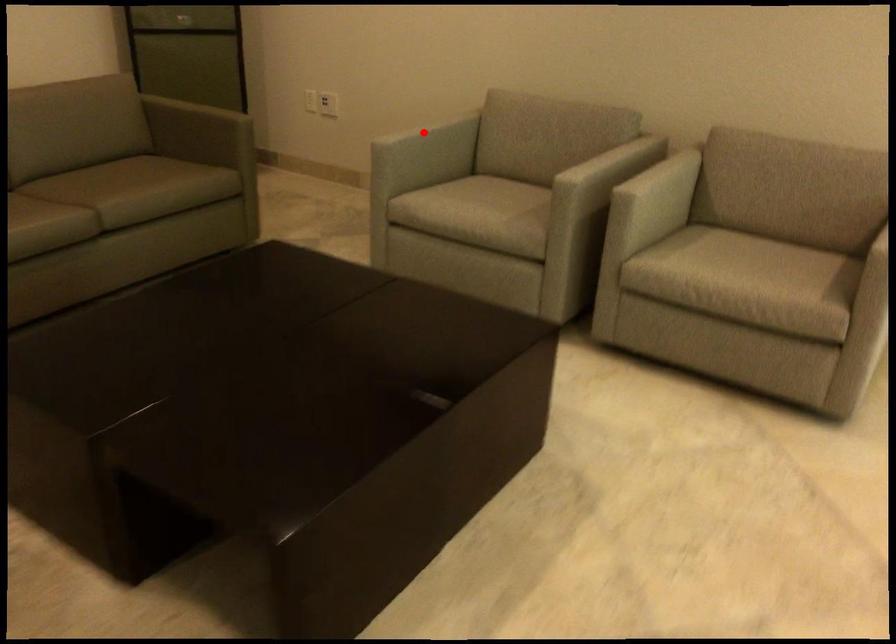
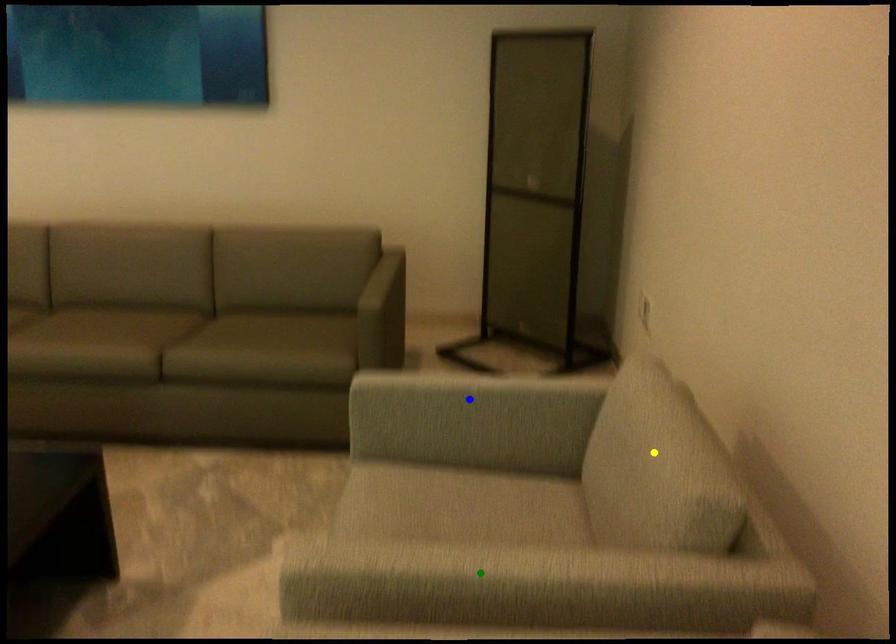
Question: I am providing you with two images of the same scene from different viewpoints. A red point is marked on the first image. You are given multiple points on the second image. Can you choose the point in image 2 that corresponds to the point in image 1?

Choices:
 (A) blue point
 (B) yellow point
 (C) green point

Answer: (A)